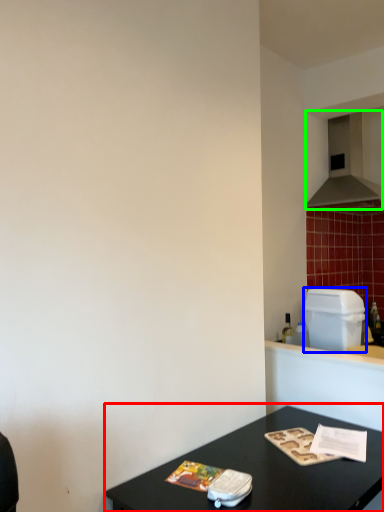
Question: Which object is positioned farthest from table (highlighted by a red box)? Select from appliance (highlighted by a blue box) and exhaust hood (highlighted by a green box).

Choices:
 (A) appliance
 (B) exhaust hood

Answer: (B)